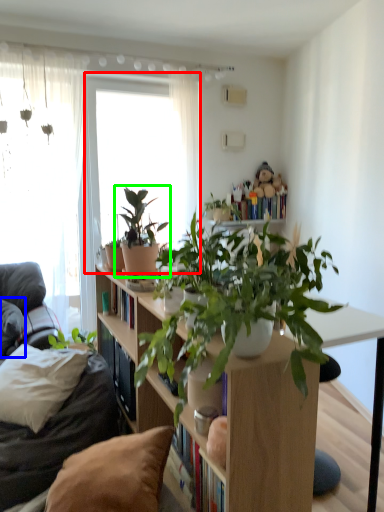
Question: Which object is positioned farthest from window (highlighted by a red box)? Select from pillow (highlighted by a blue box) and houseplant (highlighted by a green box).

Choices:
 (A) pillow
 (B) houseplant

Answer: (B)